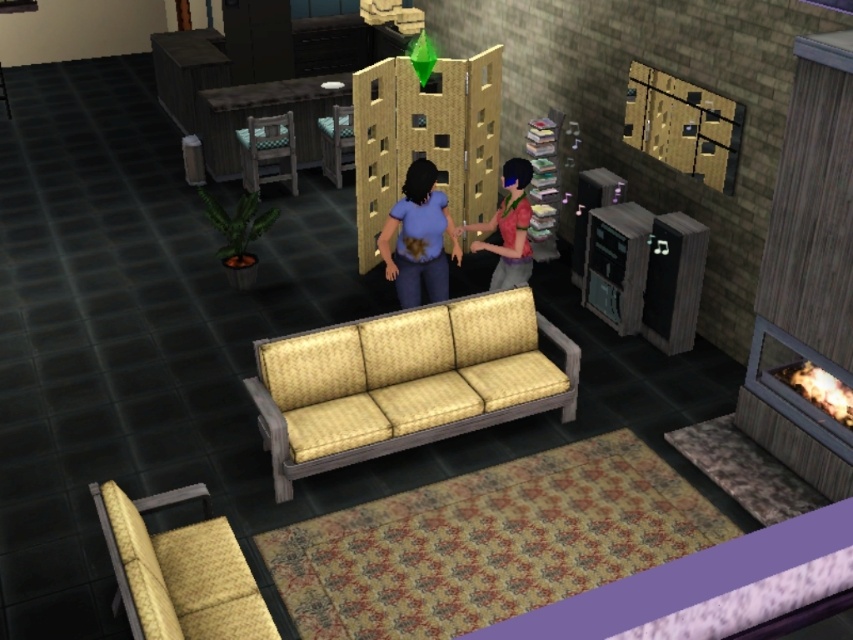
You are a character in the game and need to place an object on the wooden textured table at upper left and the matte pink shirt at center. Which object should you place first to ensure it is visible from the current camera angle?

The wooden textured table at upper left should be placed first because it is positioned on the left side of the matte pink shirt at center, making it visible from the current angle.

You are a character in the game and want to place an object on the wooden textured table at upper left. However, there is a matte pink shirt at center in the way. Can you place the object directly on the table without moving the shirt?

The wooden textured table at upper left is above the matte pink shirt at center, so you can place the object directly on the table without needing to move the shirt.

You are playing The Sims and want to place a new coffee table in front of the yellow textured couch at center. The coffee table you have is 3 feet long. Can you place it directly in front of the couch without it being too close to the camera?

The yellow textured couch at center is 18.00 feet away from the camera. Since the coffee table is only 3 feet long, placing it directly in front of the couch would leave sufficient space between the table and the camera, so yes, it can be placed without being too close.